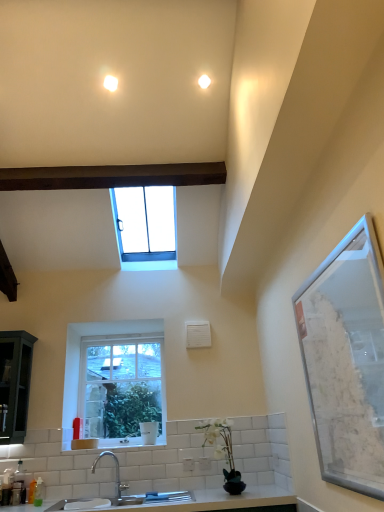
Question: Is satin nickel faucet at lower center at the right side of clear glass window at center, which is the 2th window in top-to-bottom order?

Choices:
 (A) no
 (B) yes

Answer: (B)

Question: Is satin nickel faucet at lower center located outside clear glass window at center, which is the 2th window in top-to-bottom order?

Choices:
 (A) yes
 (B) no

Answer: (A)

Question: Would you say satin nickel faucet at lower center contains clear glass window at center, which is the 2th window in top-to-bottom order?

Choices:
 (A) no
 (B) yes

Answer: (A)

Question: Is satin nickel faucet at lower center taller than clear glass window at center, which is the 2th window in top-to-bottom order?

Choices:
 (A) no
 (B) yes

Answer: (A)

Question: From a real-world perspective, is satin nickel faucet at lower center physically above clear glass window at center, which is the 2th window in top-to-bottom order?

Choices:
 (A) no
 (B) yes

Answer: (A)

Question: Which is correct: clear glass window screen at right is inside clear glass window at upper center, marked as the 2th window in a bottom-to-top arrangement, or outside of it?

Choices:
 (A) outside
 (B) inside

Answer: (A)

Question: From the image's perspective, is clear glass window screen at right located above or below clear glass window at upper center, placed as the 1th window when sorted from top to bottom?

Choices:
 (A) above
 (B) below

Answer: (B)

Question: Is clear glass window screen at right to the left or to the right of clear glass window at upper center, marked as the 2th window in a bottom-to-top arrangement, in the image?

Choices:
 (A) right
 (B) left

Answer: (A)

Question: From their relative heights in the image, would you say clear glass window screen at right is taller or shorter than clear glass window at upper center, placed as the 1th window when sorted from top to bottom?

Choices:
 (A) tall
 (B) short

Answer: (A)

Question: Which is correct: white ceramic sink at lower center is inside clear glass window at upper center, placed as the 1th window when sorted from top to bottom, or outside of it?

Choices:
 (A) outside
 (B) inside

Answer: (A)

Question: From a real-world perspective, relative to clear glass window at upper center, marked as the 2th window in a bottom-to-top arrangement, is white ceramic sink at lower center vertically above or below?

Choices:
 (A) above
 (B) below

Answer: (B)

Question: Is white ceramic sink at lower center wider or thinner than clear glass window at upper center, placed as the 1th window when sorted from top to bottom?

Choices:
 (A) thin
 (B) wide

Answer: (A)

Question: Considering their positions, is white ceramic sink at lower center located in front of or behind clear glass window at upper center, marked as the 2th window in a bottom-to-top arrangement?

Choices:
 (A) behind
 (B) front

Answer: (A)

Question: From a real-world perspective, relative to white ceramic sink at lower center, is satin nickel faucet at lower center vertically above or below?

Choices:
 (A) above
 (B) below

Answer: (B)

Question: From the image's perspective, relative to white ceramic sink at lower center, is satin nickel faucet at lower center above or below?

Choices:
 (A) above
 (B) below

Answer: (B)